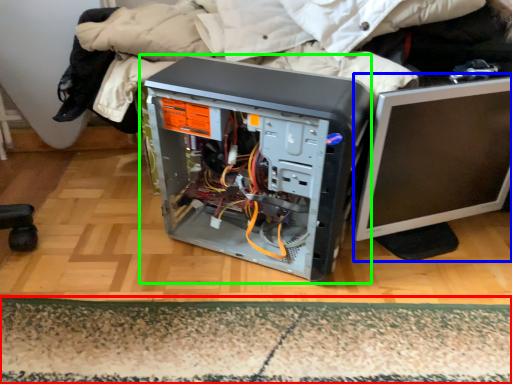
Question: Estimate the real-world distances between objects in this image. Which object is farther from mat (highlighted by a red box), computer monitor (highlighted by a blue box) or computer tower (highlighted by a green box)?

Choices:
 (A) computer monitor
 (B) computer tower

Answer: (A)